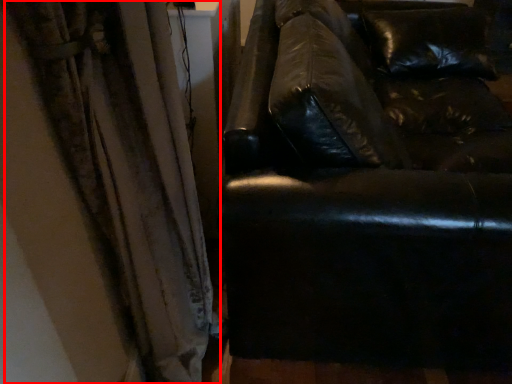
Question: From the image's perspective, where is curtain (annotated by the red box) located in relation to studio couch in the image?

Choices:
 (A) above
 (B) below

Answer: (B)